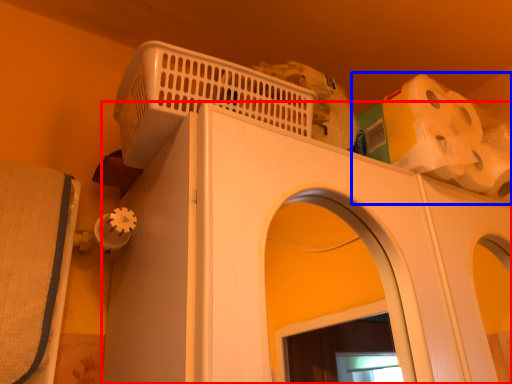
Question: Which of the following is the farthest to the observer, home appliance (highlighted by a red box) or toilet paper (highlighted by a blue box)?

Choices:
 (A) home appliance
 (B) toilet paper

Answer: (B)